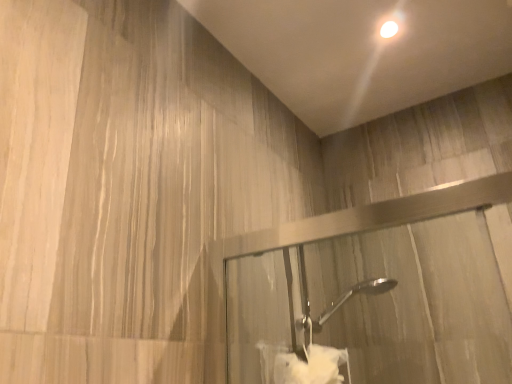
Question: Is white soft towel at lower center at the right side of white glossy droplight at upper center?

Choices:
 (A) yes
 (B) no

Answer: (B)

Question: From the image's perspective, would you say white soft towel at lower center is shown under white glossy droplight at upper center?

Choices:
 (A) no
 (B) yes

Answer: (B)

Question: Would you consider white soft towel at lower center to be distant from white glossy droplight at upper center?

Choices:
 (A) no
 (B) yes

Answer: (A)

Question: From a real-world perspective, is white soft towel at lower center over white glossy droplight at upper center?

Choices:
 (A) yes
 (B) no

Answer: (B)

Question: Does white soft towel at lower center come behind white glossy droplight at upper center?

Choices:
 (A) yes
 (B) no

Answer: (B)

Question: Does white soft towel at lower center have a greater height compared to white glossy droplight at upper center?

Choices:
 (A) no
 (B) yes

Answer: (B)

Question: From the image's perspective, does white glossy droplight at upper center appear lower than white soft towel at lower center?

Choices:
 (A) yes
 (B) no

Answer: (B)

Question: Is white glossy droplight at upper center completely or partially outside of white soft towel at lower center?

Choices:
 (A) yes
 (B) no

Answer: (A)

Question: From a real-world perspective, is white glossy droplight at upper center located beneath white soft towel at lower center?

Choices:
 (A) no
 (B) yes

Answer: (A)

Question: Does white glossy droplight at upper center lie in front of white soft towel at lower center?

Choices:
 (A) yes
 (B) no

Answer: (B)

Question: Is white glossy droplight at upper center at the right side of white soft towel at lower center?

Choices:
 (A) yes
 (B) no

Answer: (A)

Question: Is white glossy droplight at upper center wider than white soft towel at lower center?

Choices:
 (A) yes
 (B) no

Answer: (B)

Question: Would you say white soft towel at lower center is to the left or to the right of white glossy droplight at upper center in the picture?

Choices:
 (A) right
 (B) left

Answer: (B)